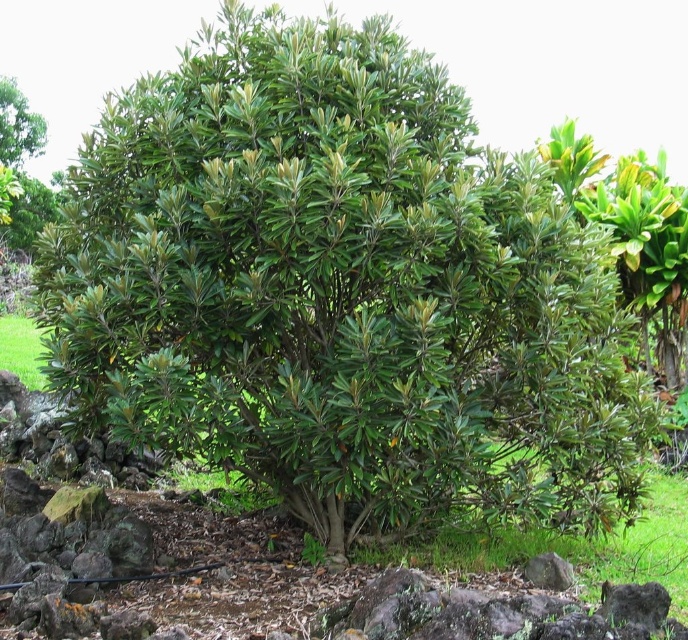
You are a gardener standing in front of the green leafy bush at upper left and the gray rock at lower right. Which object is closer to you?

The green leafy bush at upper left is closer to you because it is further to the viewer than the gray rock at lower right, meaning it appears nearer in the scene.